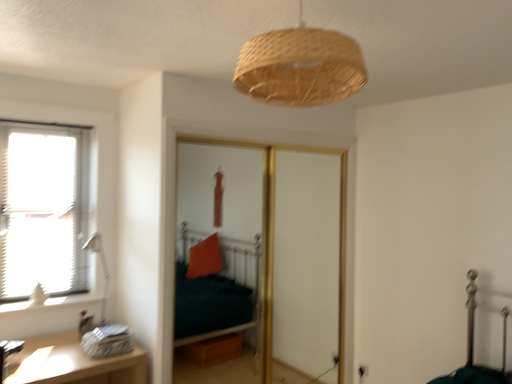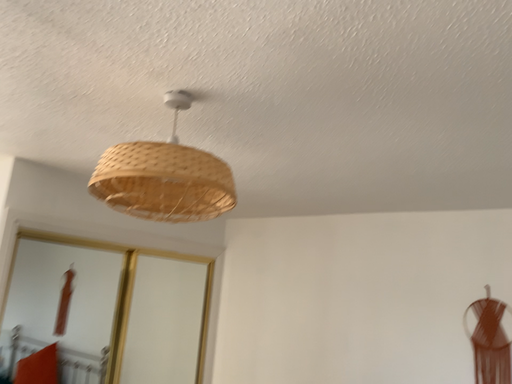
Question: How did the camera likely rotate when shooting the video?

Choices:
 (A) rotated right
 (B) rotated left

Answer: (A)